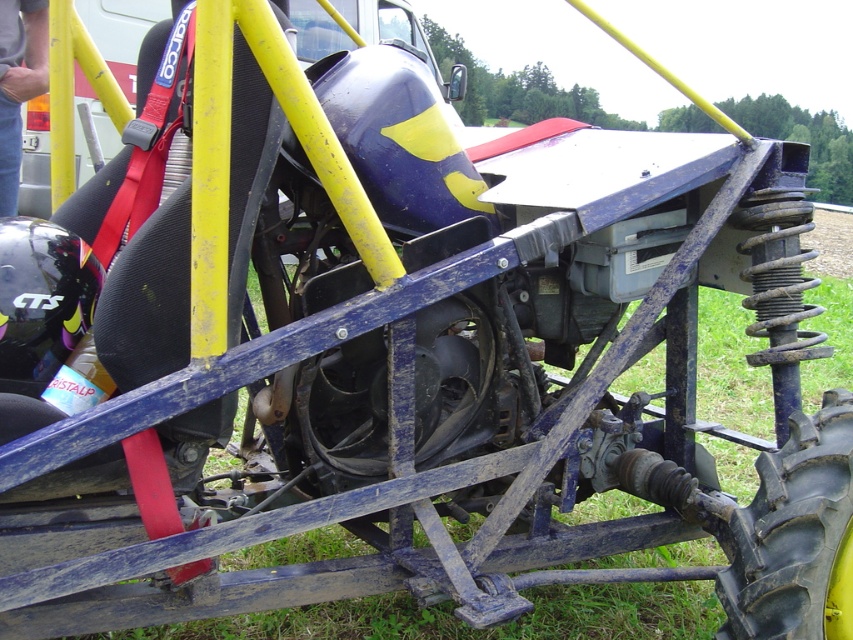
Looking at this image, does green grass at lower center appear on the right side of black rubber tire at lower right?

Yes, green grass at lower center is to the right of black rubber tire at lower right.

Based on the photo, does green grass at lower center have a lesser height compared to black rubber tire at lower right?

No.

Is point (440, 628) positioned after point (734, 515)?

That is True.

The width and height of the screenshot is (853, 640). I want to click on green grass at lower center, so click(473, 628).